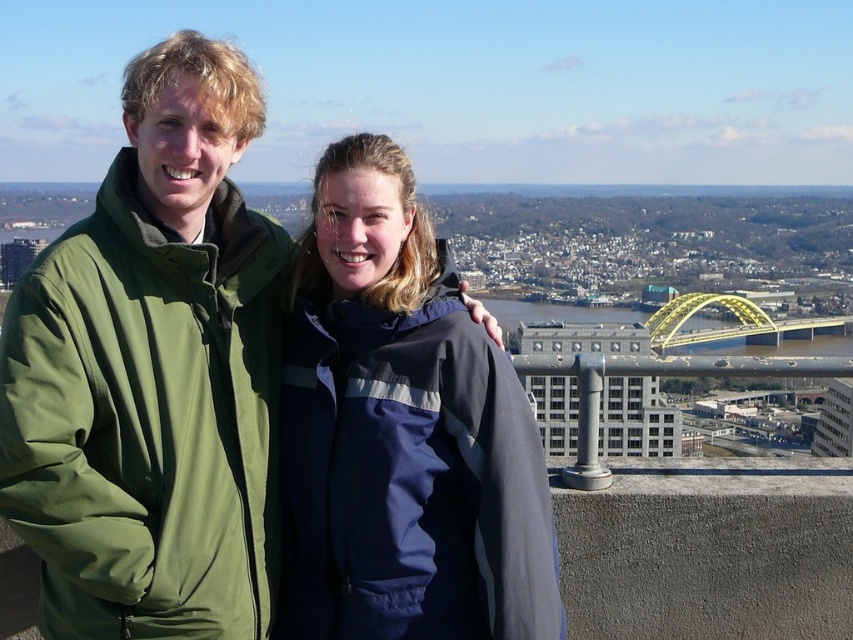
You are a fashion designer observing two jackets in an image. The green matte jacket at left and the navy blue jacket at center. Which jacket is bigger in size?

The green matte jacket at left has a larger size compared to the navy blue jacket at center.

You are a photographer trying to capture a photo of the two jackets in the scene. Since you want the green matte jacket at left to appear larger in the photo than the navy blue jacket at center, which jacket should you focus on and why?

You should focus on the green matte jacket at left because it is closer to the viewer than the navy blue jacket at center. Objects closer to the camera appear larger in photos.

You are a photographer trying to capture a group photo of the green matte jacket at left and the navy blue jacket at center. Since you want to ensure both subjects are in focus, you need to know their heights. Which jacket is taller?

The green matte jacket at left is much taller than the navy blue jacket at center.